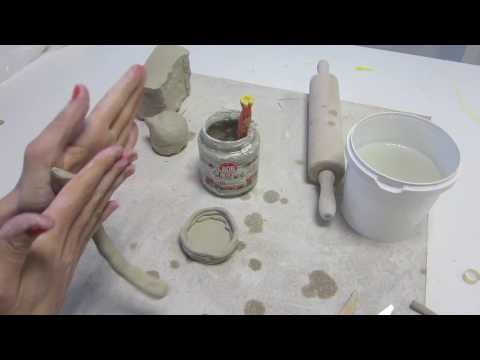
In order to click on bucket in this screenshot , I will do `click(369, 196)`.